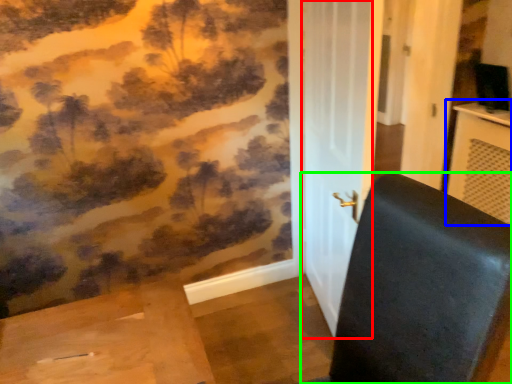
Question: Considering the real-world distances, which object is farthest from screen door (highlighted by a red box)? table (highlighted by a blue box) or furniture (highlighted by a green box)?

Choices:
 (A) table
 (B) furniture

Answer: (A)